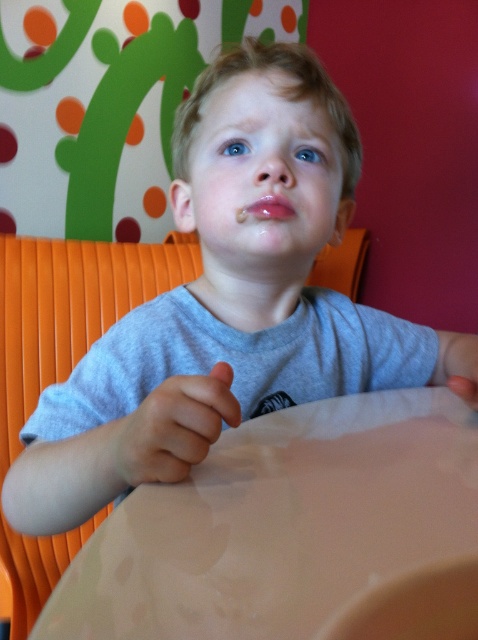
Question: Among these points, which one is farthest from the camera?

Choices:
 (A) (280, 216)
 (B) (74, 289)
 (C) (156, 536)

Answer: (B)

Question: Considering the real-world distances, which object is closest to the white glossy table at center?

Choices:
 (A) glossy pink lips at center
 (B) smooth skin hand at lower center
 (C) smooth skin hand at center
 (D) orange plastic chair at center

Answer: (C)

Question: Is orange plastic chair at center positioned in front of glossy pink lips at center?

Choices:
 (A) yes
 (B) no

Answer: (B)

Question: Does smooth skin hand at center have a greater width compared to smooth skin hand at lower center?

Choices:
 (A) no
 (B) yes

Answer: (B)

Question: Can you confirm if orange plastic chair at center is smaller than glossy pink lips at center?

Choices:
 (A) no
 (B) yes

Answer: (A)

Question: Which point is farther to the camera?

Choices:
 (A) smooth skin hand at lower center
 (B) white glossy table at center
 (C) smooth skin hand at center
 (D) orange plastic chair at center

Answer: (D)